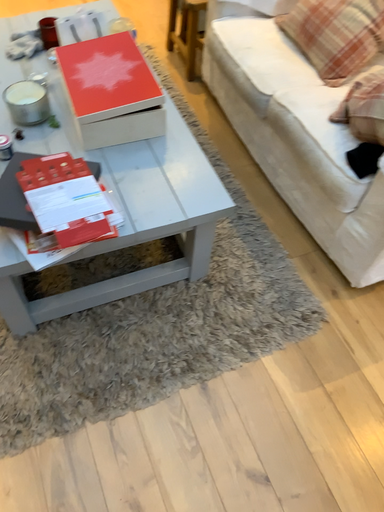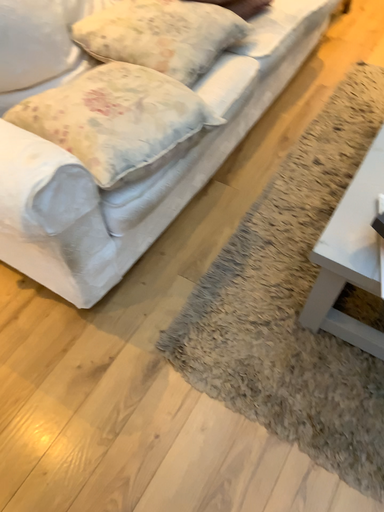
Question: How did the camera likely rotate when shooting the video?

Choices:
 (A) rotated left
 (B) rotated right

Answer: (A)